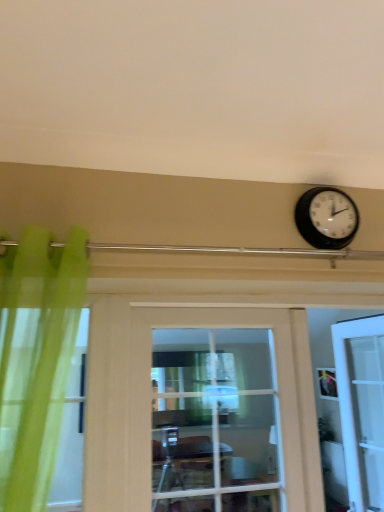
Question: Is the surface of black plastic wall clock at upper right in direct contact with white glossy door at right, which ranks as the 2th door in left-to-right order?

Choices:
 (A) no
 (B) yes

Answer: (A)

Question: From a real-world perspective, is black plastic wall clock at upper right over white glossy door at right, which ranks as the 2th door in left-to-right order?

Choices:
 (A) yes
 (B) no

Answer: (A)

Question: Would you say white glossy door at right, which ranks as the 2th door in left-to-right order, is part of black plastic wall clock at upper right's contents?

Choices:
 (A) no
 (B) yes

Answer: (A)

Question: Considering the relative sizes of black plastic wall clock at upper right and white glossy door at right, which ranks as the 2th door in left-to-right order, in the image provided, is black plastic wall clock at upper right taller than white glossy door at right, which ranks as the 2th door in left-to-right order,?

Choices:
 (A) no
 (B) yes

Answer: (A)

Question: Is black plastic wall clock at upper right thinner than white glossy door at right, marked as the first door in a back-to-front arrangement?

Choices:
 (A) yes
 (B) no

Answer: (A)

Question: In terms of width, does white glossy door at right, which is the 1th door in right-to-left order, look wider or thinner when compared to black plastic wall clock at upper right?

Choices:
 (A) thin
 (B) wide

Answer: (B)

Question: Considering the positions of point (357, 462) and point (357, 219), is point (357, 462) closer or farther from the camera than point (357, 219)?

Choices:
 (A) closer
 (B) farther

Answer: (B)

Question: Relative to black plastic wall clock at upper right, is white glossy door at right, which ranks as the 2th door in left-to-right order, in front or behind?

Choices:
 (A) behind
 (B) front

Answer: (A)

Question: Is white glossy door at right, which ranks as the 2th door in left-to-right order, taller or shorter than black plastic wall clock at upper right?

Choices:
 (A) short
 (B) tall

Answer: (B)

Question: Looking at their shapes, would you say clear glass door at center, the 2th door when ordered from right to left, is wider or thinner than white glossy door at right, marked as the first door in a back-to-front arrangement?

Choices:
 (A) wide
 (B) thin

Answer: (A)

Question: Based on their sizes in the image, would you say clear glass door at center, which is the 1th door from left to right, is bigger or smaller than white glossy door at right, which ranks as the 2th door in left-to-right order?

Choices:
 (A) big
 (B) small

Answer: (B)

Question: Considering the positions of clear glass door at center, which is the 1th door from left to right, and white glossy door at right, which is the 1th door in right-to-left order, in the image, is clear glass door at center, which is the 1th door from left to right, taller or shorter than white glossy door at right, which is the 1th door in right-to-left order,?

Choices:
 (A) short
 (B) tall

Answer: (A)

Question: Is clear glass door at center, arranged as the first door when viewed from the front, in front of or behind white glossy door at right, which is the 2th door in front-to-back order, in the image?

Choices:
 (A) behind
 (B) front

Answer: (B)

Question: From the image's perspective, is black plastic wall clock at upper right located above or below white glossy door at right, marked as the first door in a back-to-front arrangement?

Choices:
 (A) above
 (B) below

Answer: (A)

Question: Is black plastic wall clock at upper right inside the boundaries of white glossy door at right, which ranks as the 2th door in left-to-right order, or outside?

Choices:
 (A) inside
 (B) outside

Answer: (B)